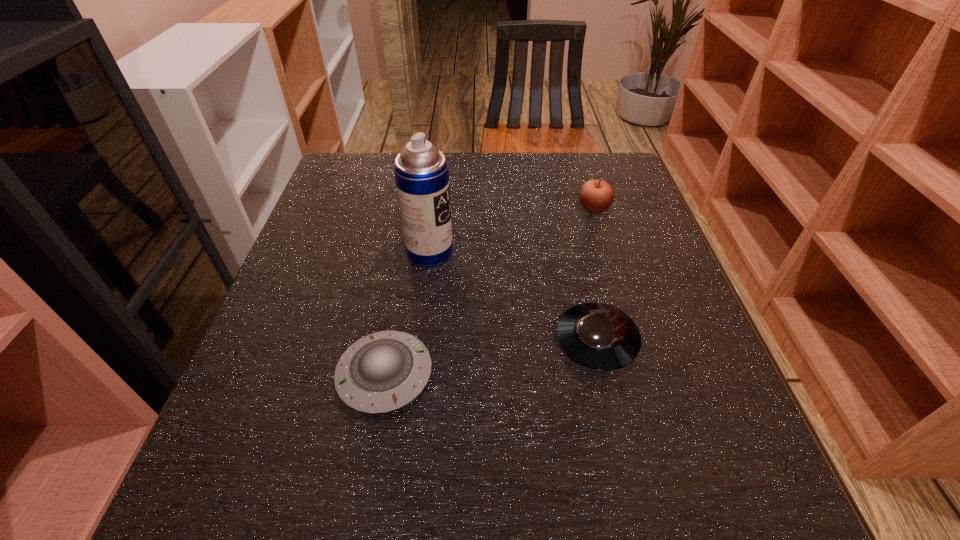
The image size is (960, 540). I want to click on aerosol can, so click(421, 171).

Identify the location of the tallest object. (421, 171).

At what (x,y) coordinates should I click in order to perform the action: click on apple. Please return your answer as a coordinate pair (x, y). Image resolution: width=960 pixels, height=540 pixels. Looking at the image, I should click on (596, 196).

The width and height of the screenshot is (960, 540). I want to click on the second tallest object, so click(x=596, y=196).

Identify the location of the right saucer. The image size is (960, 540). (598, 336).

Image resolution: width=960 pixels, height=540 pixels. In order to click on the shortest object in this screenshot , I will do `click(383, 371)`.

This screenshot has height=540, width=960. In order to click on the left saucer in this screenshot , I will do click(x=383, y=371).

Locate an element on the screen. vacant region located 0.130m on the label side of the aerosol can is located at coordinates (512, 252).

Identify the location of vacant area located on the front of the third shortest object. The height and width of the screenshot is (540, 960). (624, 310).

The height and width of the screenshot is (540, 960). What are the coordinates of `vacant space located on the front of the right saucer` in the screenshot? It's located at (636, 516).